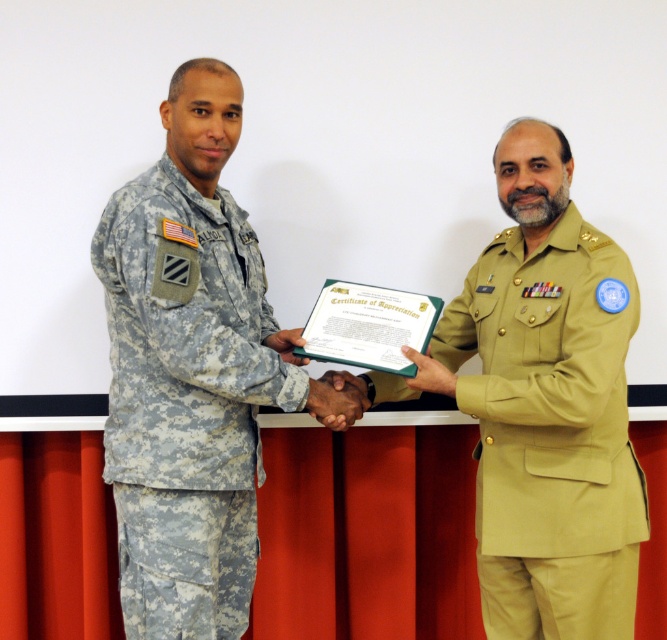
Which is more to the left, camouflage fabric uniform at left or khaki fabric uniform at right?

Positioned to the left is camouflage fabric uniform at left.

Does camouflage fabric uniform at left appear under khaki fabric uniform at right?

Incorrect, camouflage fabric uniform at left is not positioned below khaki fabric uniform at right.

Between point (159, 621) and point (522, 333), which one is positioned in front?

Point (159, 621) is in front.

This screenshot has width=667, height=640. In order to click on camouflage fabric uniform at left in this screenshot , I will do click(x=185, y=401).